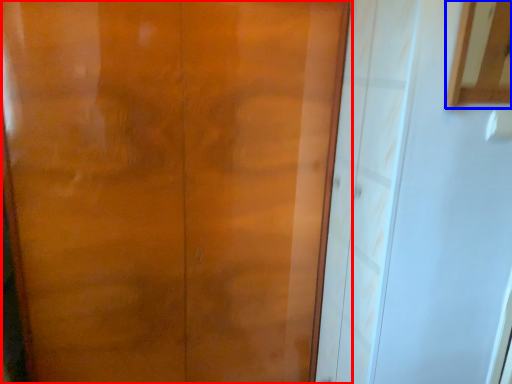
Question: Which object appears closest to the camera in this image, door (highlighted by a red box) or cabinetry (highlighted by a blue box)?

Choices:
 (A) door
 (B) cabinetry

Answer: (B)